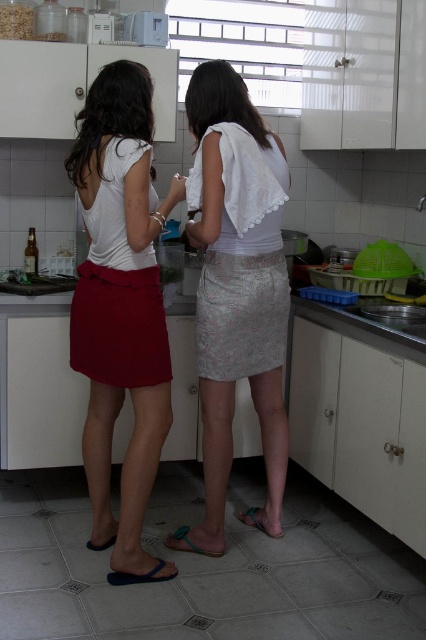
Question: Is matte red skirt at left wider than white lace skirt at center?

Choices:
 (A) no
 (B) yes

Answer: (A)

Question: Is matte red skirt at left below white lace skirt at center?

Choices:
 (A) yes
 (B) no

Answer: (A)

Question: Which of the following is the farthest from the observer?

Choices:
 (A) matte red skirt at left
 (B) white lace skirt at center

Answer: (B)

Question: Which point appears farthest from the camera in this image?

Choices:
 (A) (126, 522)
 (B) (215, 481)

Answer: (B)

Question: Can you confirm if matte red skirt at left is positioned below white lace skirt at center?

Choices:
 (A) yes
 (B) no

Answer: (A)